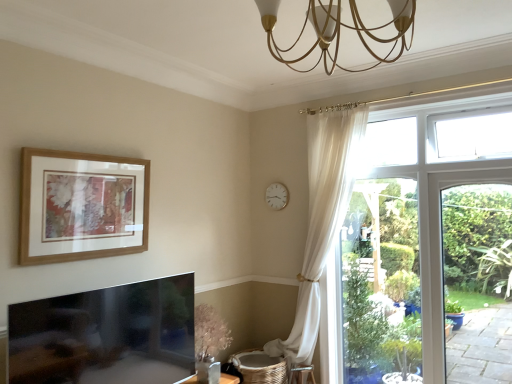
Question: From a real-world perspective, relative to gold metallic chandelier at upper center, is white plastic clock at upper center vertically above or below?

Choices:
 (A) above
 (B) below

Answer: (B)

Question: In the image, is white plastic clock at upper center positioned in front of or behind gold metallic chandelier at upper center?

Choices:
 (A) front
 (B) behind

Answer: (B)

Question: Estimate the real-world distances between objects in this image. Which object is farther from the white plastic clock at upper center?

Choices:
 (A) gold metallic chandelier at upper center
 (B) wooden picture frame at upper left

Answer: (A)

Question: Considering the real-world distances, which object is farthest from the gold metallic chandelier at upper center?

Choices:
 (A) white plastic clock at upper center
 (B) wooden picture frame at upper left

Answer: (A)